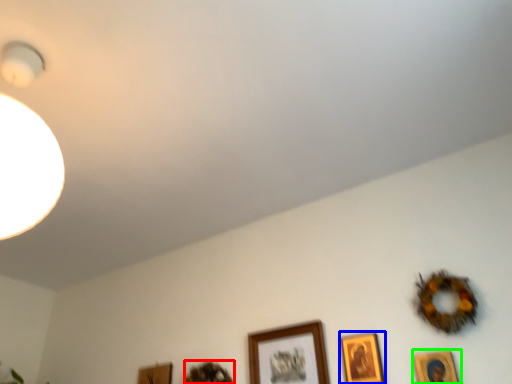
Question: Based on their relative distances, which object is farther from picture frame (highlighted by a red box)? Choose from picture frame (highlighted by a blue box) and picture frame (highlighted by a green box).

Choices:
 (A) picture frame
 (B) picture frame

Answer: (B)